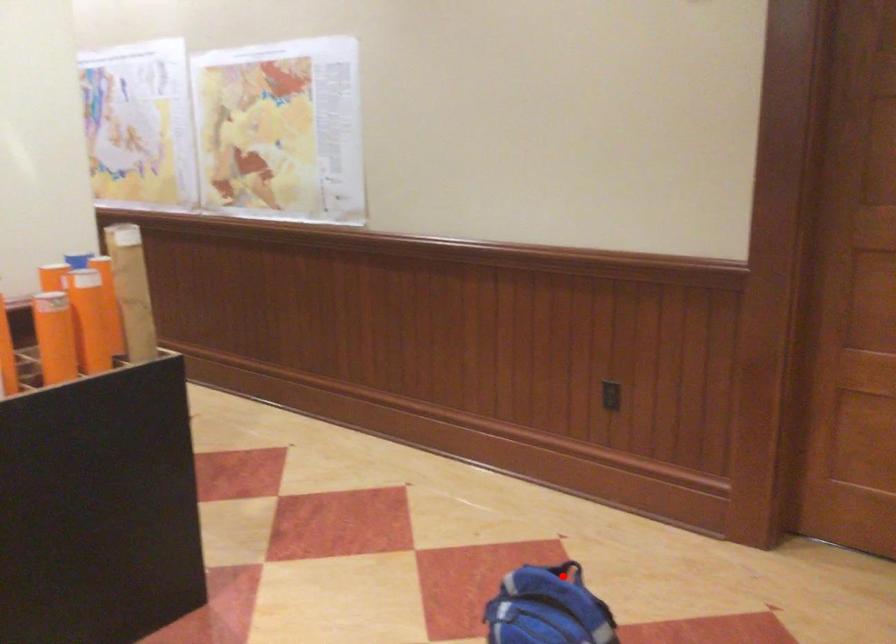
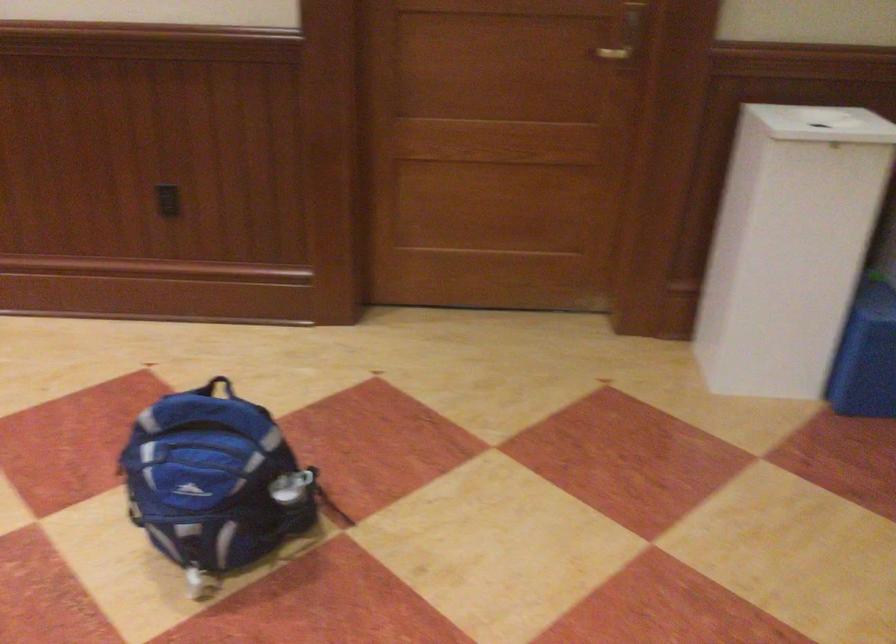
Question: I am providing you with two images of the same scene from different viewpoints. Given a red point in image1, look at the same physical point in image2. Is it:

Choices:
 (A) Closer to the viewpoint
 (B) Farther from the viewpoint

Answer: (A)